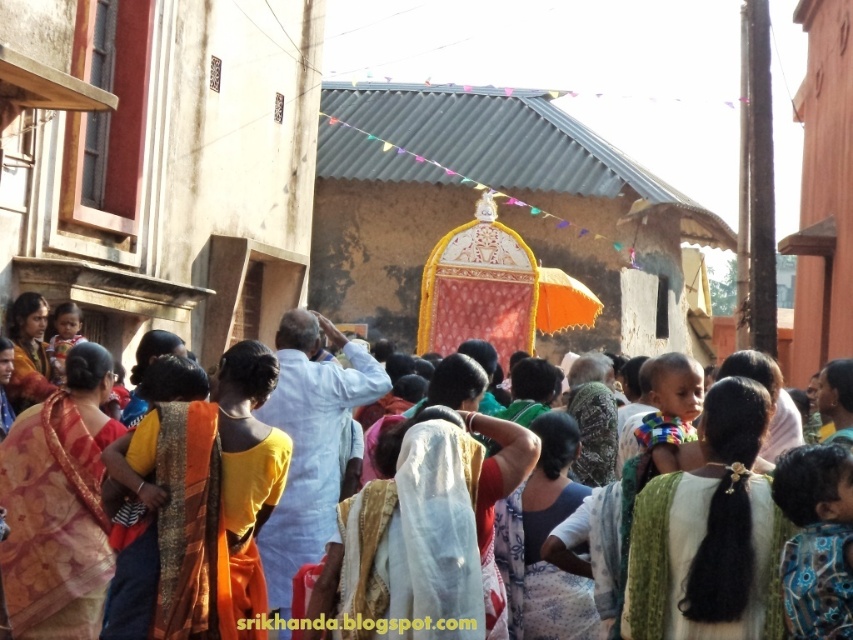
Describe the element at coordinates (709, 532) in the screenshot. I see `multicolored fabric at center` at that location.

Who is positioned more to the right, multicolored fabric at center or matte orange cloth at center?

Positioned to the right is multicolored fabric at center.

Is point (718, 440) closer to viewer compared to point (350, 403)?

Yes, point (718, 440) is closer to viewer.

Where is `multicolored fabric at center`? multicolored fabric at center is located at coordinates (709, 532).

Looking at this image, which is more to the left, silk saree at center or matte orange cloth at center?

From the viewer's perspective, silk saree at center appears more on the left side.

Does silk saree at center appear over matte orange cloth at center?

Actually, silk saree at center is below matte orange cloth at center.

Does point (83, 486) lie behind point (718, 387)?

No, (83, 486) is closer to viewer.

This screenshot has height=640, width=853. What are the coordinates of `silk saree at center` in the screenshot? It's located at (57, 506).

Who is positioned more to the left, blue fabric saree at center or matte orange saree at left?

matte orange saree at left is more to the left.

How much distance is there between blue fabric saree at center and matte orange saree at left?

blue fabric saree at center and matte orange saree at left are 25.42 meters apart.

Is point (515, 624) positioned behind point (30, 296)?

That is False.

Where is `blue fabric saree at center`? blue fabric saree at center is located at coordinates (543, 541).